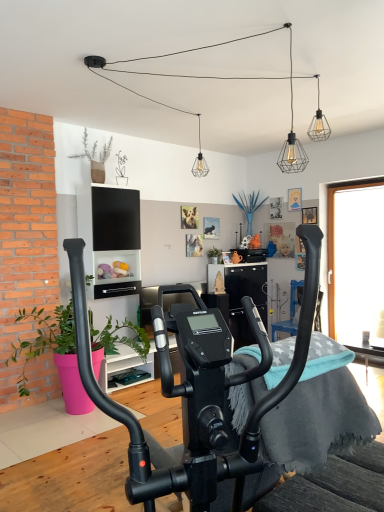
At what (x,y) coordinates should I click in order to perform the action: click on green matte plant at center, the 1th plant when ordered from right to left. Please return your answer as a coordinate pair (x, y). This screenshot has height=512, width=384. Looking at the image, I should click on (x=215, y=254).

What do you see at coordinates (215, 254) in the screenshot? I see `green matte plant at center, which is the second plant in front-to-back order` at bounding box center [215, 254].

The width and height of the screenshot is (384, 512). What do you see at coordinates (367, 354) in the screenshot?
I see `wooden table at lower right` at bounding box center [367, 354].

Measure the distance between point (199, 125) and camera.

4.67 meters.

Where is `blue fabric armchair at center`? The height and width of the screenshot is (512, 384). blue fabric armchair at center is located at coordinates (284, 327).

Can you confirm if metal wire cage at upper center is bigger than black matte stationary bicycle at center?

Incorrect, metal wire cage at upper center is not larger than black matte stationary bicycle at center.

Looking at this image, considering the relative positions of metal wire cage at upper center and black matte stationary bicycle at center in the image provided, is metal wire cage at upper center to the right of black matte stationary bicycle at center from the viewer's perspective?

In fact, metal wire cage at upper center is to the left of black matte stationary bicycle at center.

Looking at this image, is metal wire cage at upper center positioned behind black matte stationary bicycle at center?

Yes, metal wire cage at upper center is behind black matte stationary bicycle at center.

From a real-world perspective, is green matte plant at center, which is the second plant in front-to-back order, physically above gray fleece blanket at center?

Yes, from a real-world perspective, green matte plant at center, which is the second plant in front-to-back order, is over gray fleece blanket at center

Which is closer to the camera, (x=210, y=252) or (x=255, y=353)?

Point (x=210, y=252) is positioned farther from the camera compared to point (x=255, y=353).

Relative to gray fleece blanket at center, is green matte plant at center, arranged as the first plant when viewed from the back, in front or behind?

green matte plant at center, arranged as the first plant when viewed from the back, is behind gray fleece blanket at center.

The width and height of the screenshot is (384, 512). Find the location of `armchair behind the metal wire cage at upper center`. armchair behind the metal wire cage at upper center is located at coordinates (284, 327).

Is blue fabric armchair at center positioned behind metal wire cage at upper center?

Yes, blue fabric armchair at center is further from the viewer.

From the image's perspective, which object appears higher, blue fabric armchair at center or metal wire cage at upper center?

metal wire cage at upper center is shown above in the image.

Based on their positions, is blue fabric armchair at center located to the left or right of metal wire cage at upper center?

Based on their positions, blue fabric armchair at center is located to the right of metal wire cage at upper center.

From the image's perspective, between blue fabric armchair at center and wooden table at lower right, who is located below?

wooden table at lower right.

Does point (291, 287) lie behind point (346, 344)?

No, it is in front of (346, 344).

Considering the positions of objects blue fabric armchair at center and wooden table at lower right in the image provided, who is more to the left, blue fabric armchair at center or wooden table at lower right?

blue fabric armchair at center is more to the left.

Between black matte stationary bicycle at center and green matte plant at center, arranged as the first plant when viewed from the back, which one has less height?

With less height is green matte plant at center, arranged as the first plant when viewed from the back.

Which object is wider, black matte stationary bicycle at center or green matte plant at center, marked as the 2th plant in a bottom-to-top arrangement?

With larger width is black matte stationary bicycle at center.

Looking at this image, from a real-world perspective, is black matte stationary bicycle at center below green matte plant at center, which ranks as the 1th plant in top-to-bottom order?

Yes.

This screenshot has height=512, width=384. I want to click on stationary bicycle located in front of the gray fleece blanket at center, so click(198, 395).

Is black matte stationary bicycle at center oriented away from gray fleece blanket at center?

No, gray fleece blanket at center is not at the back of black matte stationary bicycle at center.

Which is nearer, [260,373] or [244,396]?

Positioned in front is point [260,373].

How different are the orientations of green matte plant at left, the 2th plant in the right-to-left sequence, and black matte stationary bicycle at center in degrees?

The facing directions of green matte plant at left, the 2th plant in the right-to-left sequence, and black matte stationary bicycle at center are 159 degrees apart.

Considering the points (104, 350) and (241, 481), which point is behind, point (104, 350) or point (241, 481)?

The point (104, 350) is behind.

From a real-world perspective, between green matte plant at left, the 2th plant in the right-to-left sequence, and black matte stationary bicycle at center, who is vertically lower?

green matte plant at left, the 2th plant in the right-to-left sequence, from a real-world perspective.

Who is smaller, green matte plant at left, the 1th plant from the front, or black matte stationary bicycle at center?

black matte stationary bicycle at center.

Where is `light fixture lying behind the black matte stationary bicycle at center`? This screenshot has width=384, height=512. light fixture lying behind the black matte stationary bicycle at center is located at coordinates (200, 161).

Locate an element on the screen. This screenshot has height=512, width=384. plant above the gray fleece blanket at center (from the image's perspective) is located at coordinates (215, 254).

Looking at the image, which one is located closer to blue fabric armchair at center, green matte plant at left, arranged as the second plant when viewed from the top, or metal wire cage at upper center?

The object closer to blue fabric armchair at center is green matte plant at left, arranged as the second plant when viewed from the top.

Looking at the image, which one is located further to metal wire cage at upper center, green matte plant at center, arranged as the first plant when viewed from the back, or black matte stationary bicycle at center?

Among the two, black matte stationary bicycle at center is located further to metal wire cage at upper center.

Considering their positions, is blue fabric armchair at center positioned further to gray fleece blanket at center than black matte stationary bicycle at center?

The object further to gray fleece blanket at center is blue fabric armchair at center.

From the image, which object appears to be nearer to black matte stationary bicycle at center, wooden table at lower right or green matte plant at left, positioned as the 1th plant in bottom-to-top order?

wooden table at lower right is closer to black matte stationary bicycle at center.

Considering their positions, is metal wire cage at upper center positioned further to green matte plant at center, the 2th plant viewed from the left, than black matte stationary bicycle at center?

black matte stationary bicycle at center lies further to green matte plant at center, the 2th plant viewed from the left, than the other object.

Which object lies further to the anchor point green matte plant at center, the 1th plant when ordered from right to left, black matte stationary bicycle at center or blue fabric armchair at center?

Based on the image, black matte stationary bicycle at center appears to be further to green matte plant at center, the 1th plant when ordered from right to left.

When comparing their distances from wooden table at lower right, does metal wire cage at upper center or black matte stationary bicycle at center seem closer?

Among the two, black matte stationary bicycle at center is located nearer to wooden table at lower right.

Considering their positions, is blue fabric armchair at center positioned closer to green matte plant at left, arranged as the second plant when viewed from the top, than black matte stationary bicycle at center?

The object closer to green matte plant at left, arranged as the second plant when viewed from the top, is black matte stationary bicycle at center.

Identify the location of plant between gray fleece blanket at center and metal wire cage at upper center from front to back. (44, 338).

Image resolution: width=384 pixels, height=512 pixels. Identify the location of plant between gray fleece blanket at center and blue fabric armchair at center along the z-axis. (44, 338).

Where is `bedding between green matte plant at left, the second plant viewed from the back, and wooden table at lower right, in the horizontal direction`? bedding between green matte plant at left, the second plant viewed from the back, and wooden table at lower right, in the horizontal direction is located at coordinates (319, 412).

Find the location of a particular element. light fixture between gray fleece blanket at center and green matte plant at center, which is the second plant in front-to-back order, in the front-back direction is located at coordinates (200, 161).